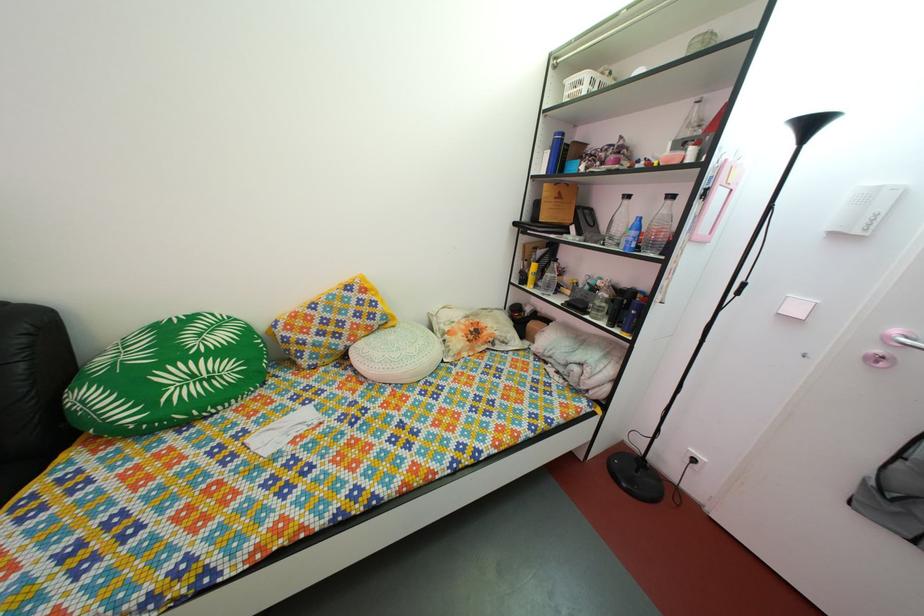
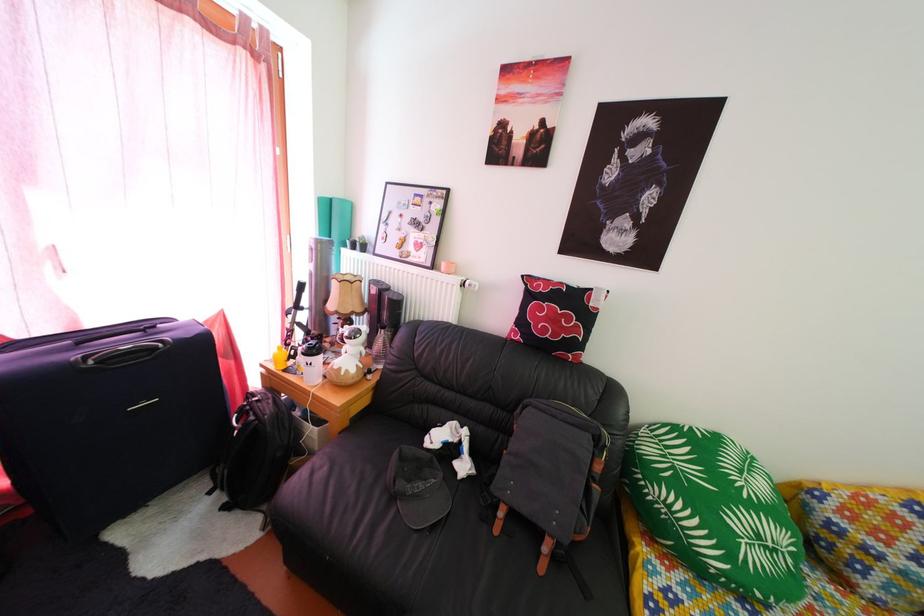
Find the pixel in the second image that matches pixel 220 387 in the first image.

(784, 560)